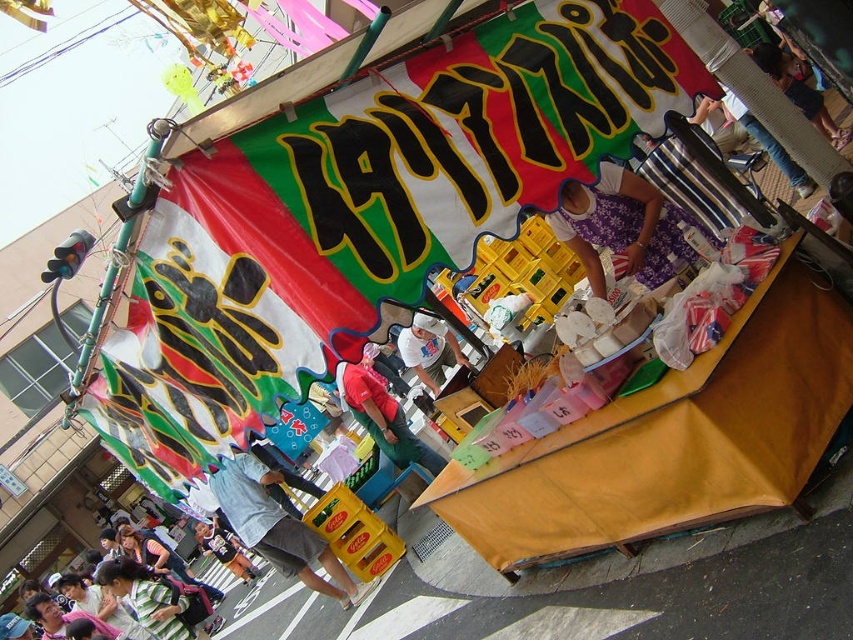
Between point (664, 220) and point (430, 336), which one is positioned behind?

Point (430, 336)

Describe the element at coordinates (622, 227) in the screenshot. I see `purple fabric dress at center` at that location.

Where is `purple fabric dress at center`? purple fabric dress at center is located at coordinates (622, 227).

Who is positioned more to the left, denim shorts at lower left or light blue denim jacket at lower left?

Positioned to the left is light blue denim jacket at lower left.

Is point (285, 540) closer to viewer compared to point (257, 570)?

Yes, it is in front of point (257, 570).

Find the location of a particular element. denim shorts at lower left is located at coordinates (276, 525).

Can you confirm if white cotton t-shirt at center is wider than light blue denim jacket at lower left?

No.

Which of these two, white cotton t-shirt at center or light blue denim jacket at lower left, stands shorter?

Standing shorter between the two is white cotton t-shirt at center.

Does point (409, 330) lie in front of point (213, 529)?

Yes, it is.

In order to click on white cotton t-shirt at center in this screenshot , I will do `click(428, 349)`.